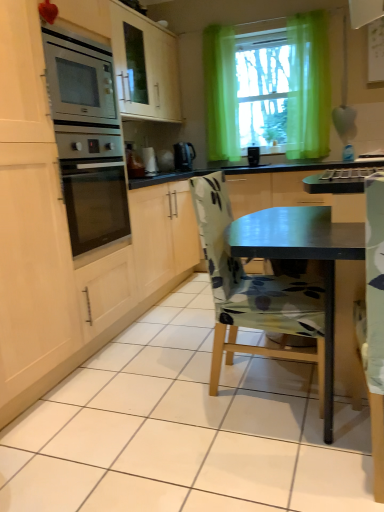
Question: Is black plastic kettle at center looking in the opposite direction of white glossy kettle at center?

Choices:
 (A) yes
 (B) no

Answer: (A)

Question: From a real-world perspective, is black plastic kettle at center beneath white glossy kettle at center?

Choices:
 (A) no
 (B) yes

Answer: (B)

Question: Is black plastic kettle at center not within white glossy kettle at center?

Choices:
 (A) no
 (B) yes

Answer: (B)

Question: From a real-world perspective, is black plastic kettle at center on white glossy kettle at center?

Choices:
 (A) yes
 (B) no

Answer: (B)

Question: Does black plastic kettle at center lie behind white glossy kettle at center?

Choices:
 (A) yes
 (B) no

Answer: (B)

Question: From their relative heights in the image, would you say white glossy kettle at center is taller or shorter than green sheer curtain at upper center?

Choices:
 (A) tall
 (B) short

Answer: (B)

Question: Considering their positions, is white glossy kettle at center located in front of or behind green sheer curtain at upper center?

Choices:
 (A) behind
 (B) front

Answer: (A)

Question: Based on their sizes in the image, would you say white glossy kettle at center is bigger or smaller than green sheer curtain at upper center?

Choices:
 (A) small
 (B) big

Answer: (A)

Question: Visually, is white glossy kettle at center positioned to the left or to the right of green sheer curtain at upper center?

Choices:
 (A) right
 (B) left

Answer: (B)

Question: Choose the correct answer: Is black plastic kettle at center inside floral fabric chair at center or outside it?

Choices:
 (A) inside
 (B) outside

Answer: (B)

Question: From their relative heights in the image, would you say black plastic kettle at center is taller or shorter than floral fabric chair at center?

Choices:
 (A) short
 (B) tall

Answer: (A)

Question: Is black plastic kettle at center to the left or to the right of floral fabric chair at center in the image?

Choices:
 (A) left
 (B) right

Answer: (A)

Question: Is point (177, 153) closer or farther from the camera than point (210, 243)?

Choices:
 (A) closer
 (B) farther

Answer: (B)

Question: From the image's perspective, is white glossy kettle at center positioned above or below green sheer curtain at upper center?

Choices:
 (A) below
 (B) above

Answer: (A)

Question: Is white glossy kettle at center in front of or behind green sheer curtain at upper center in the image?

Choices:
 (A) front
 (B) behind

Answer: (B)